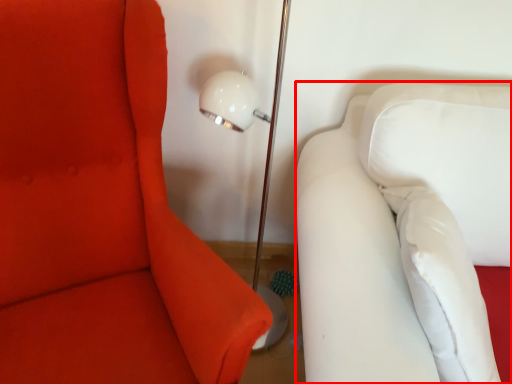
Question: From the image's perspective, where is furniture (annotated by the red box) located relative to furniture?

Choices:
 (A) below
 (B) above

Answer: (A)